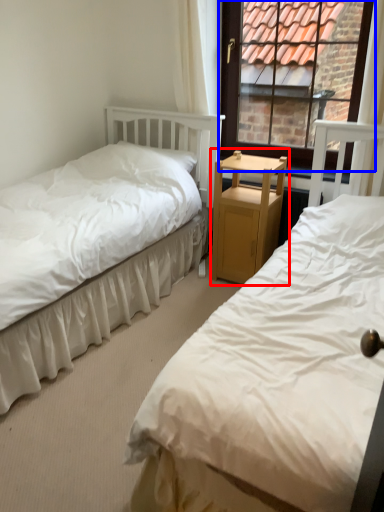
Question: Which point is closer to the camera, nightstand (highlighted by a red box) or window (highlighted by a blue box)?

Choices:
 (A) nightstand
 (B) window

Answer: (B)